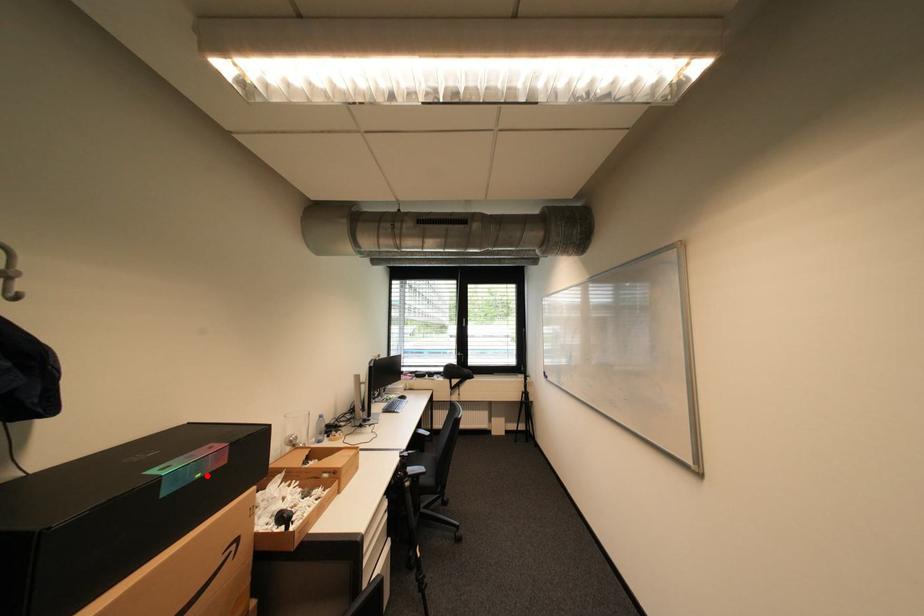
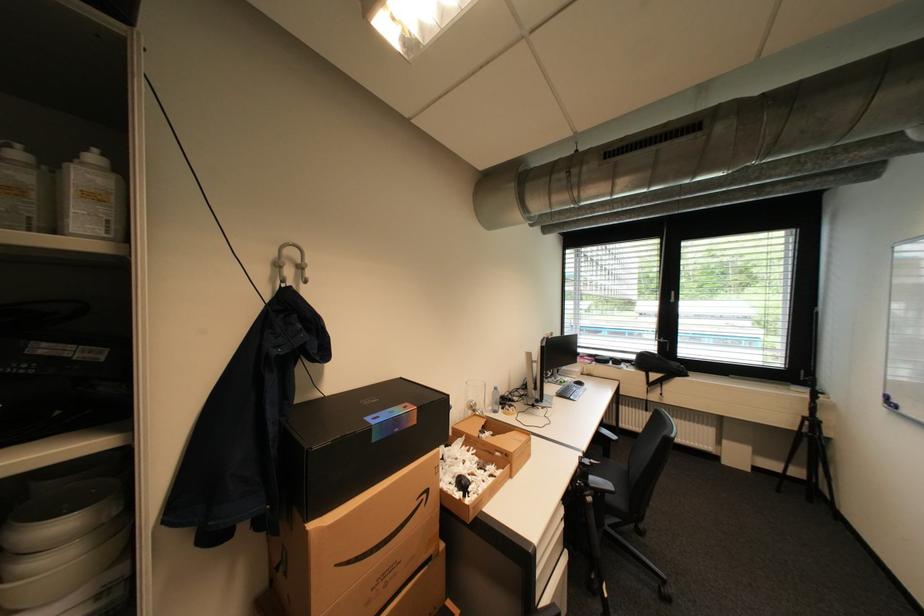
Locate, in the second image, the point that corresponds to the highlighted location in the first image.

(405, 431)